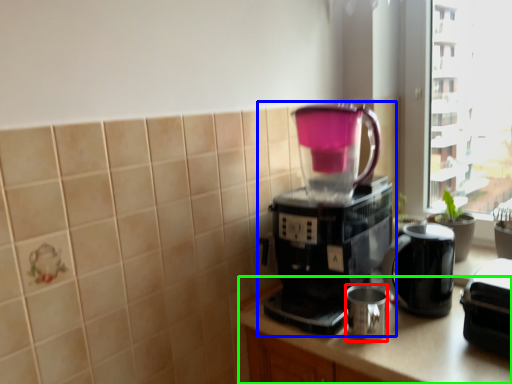
Question: Which is nearer to the mug (highlighted by a red box)? coffee maker (highlighted by a blue box) or counter top (highlighted by a green box).

Choices:
 (A) coffee maker
 (B) counter top

Answer: (B)